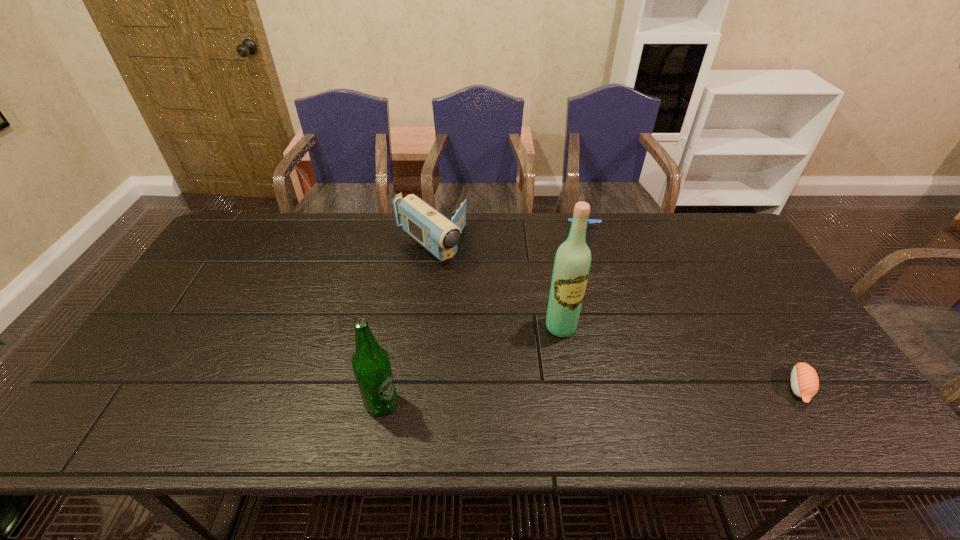
Identify the location of beer bottle. (371, 366).

Where is `the shortest object`? The height and width of the screenshot is (540, 960). the shortest object is located at coordinates (804, 380).

Identify the location of sushi. The height and width of the screenshot is (540, 960). (804, 380).

Find the location of a particular element. the third object from right to left is located at coordinates (572, 262).

The image size is (960, 540). I want to click on wine bottle, so click(572, 262).

This screenshot has height=540, width=960. Find the location of `camcorder`. camcorder is located at coordinates (436, 233).

Locate an element on the screen. The height and width of the screenshot is (540, 960). the fourth tallest object is located at coordinates (590, 221).

Find the location of `Lego`. Lego is located at coordinates (590, 221).

Where is `free space located 0.220m on the label of the beer bottle`? Image resolution: width=960 pixels, height=540 pixels. free space located 0.220m on the label of the beer bottle is located at coordinates (493, 403).

Where is `vacant space located 0.350m on the left of the sushi`? vacant space located 0.350m on the left of the sushi is located at coordinates (640, 388).